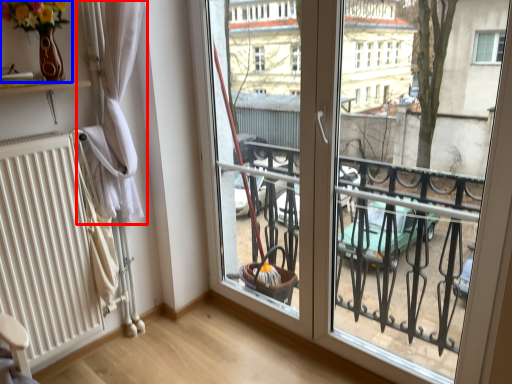
Question: Which object is further to the camera taking this photo, curtain (highlighted by a red box) or floral arrangement (highlighted by a blue box)?

Choices:
 (A) curtain
 (B) floral arrangement

Answer: (A)